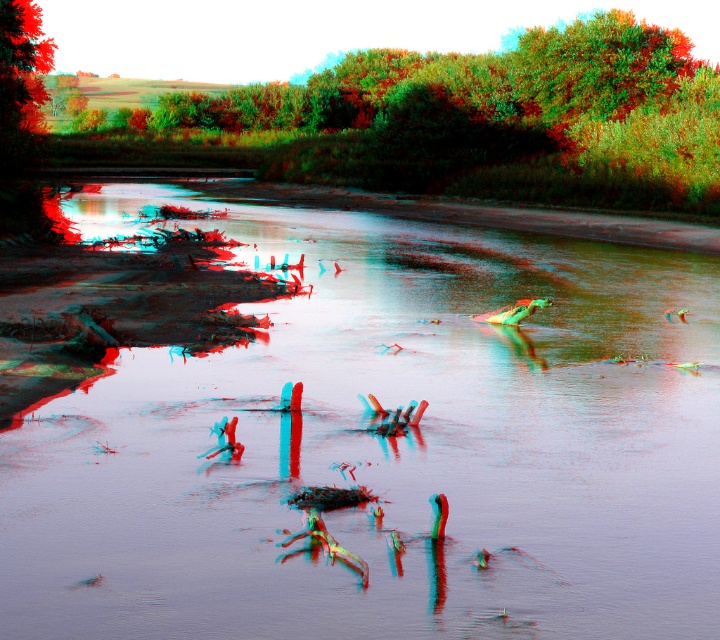
Does translucent plastic river at center have a greater width compared to green leafy tree at upper center?

Incorrect, translucent plastic river at center's width does not surpass green leafy tree at upper center's.

Can you confirm if translucent plastic river at center is positioned above green leafy tree at upper center?

Actually, translucent plastic river at center is below green leafy tree at upper center.

Between point (120, 198) and point (618, 109), which one is positioned in front?

Point (120, 198) is more forward.

Locate an element on the screen. translucent plastic river at center is located at coordinates (384, 444).

Is point (132, 404) behind point (40, 125)?

That is False.

Does translucent plastic river at center have a greater width compared to green leafy tree at upper left?

Correct, the width of translucent plastic river at center exceeds that of green leafy tree at upper left.

Is point (386, 248) positioned in front of point (6, 60)?

Yes, it is.

Where is `translucent plastic river at center`? translucent plastic river at center is located at coordinates (384, 444).

Does green leafy tree at upper center come behind green leafy tree at upper left?

That is False.

I want to click on green leafy tree at upper center, so click(490, 118).

At what (x,y) coordinates should I click in order to perform the action: click on green leafy tree at upper center. Please return your answer as a coordinate pair (x, y). The width and height of the screenshot is (720, 640). Looking at the image, I should click on (490, 118).